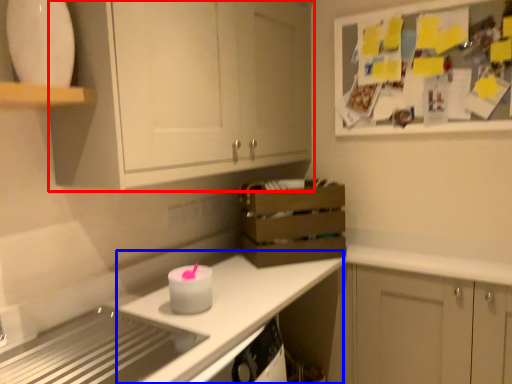
Question: Which of the following is the farthest to the observer, cabinetry (highlighted by a red box) or counter top (highlighted by a blue box)?

Choices:
 (A) cabinetry
 (B) counter top

Answer: (B)